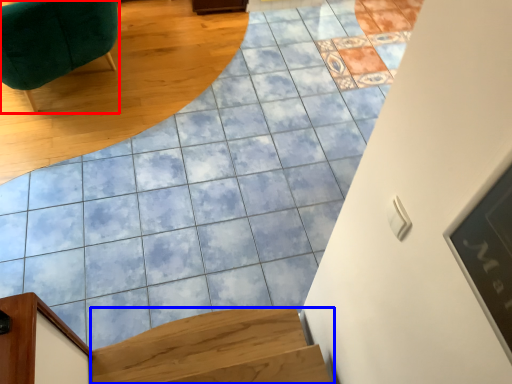
Question: Which object appears closest to the camera in this image, furniture (highlighted by a red box) or stairs (highlighted by a blue box)?

Choices:
 (A) furniture
 (B) stairs

Answer: (B)